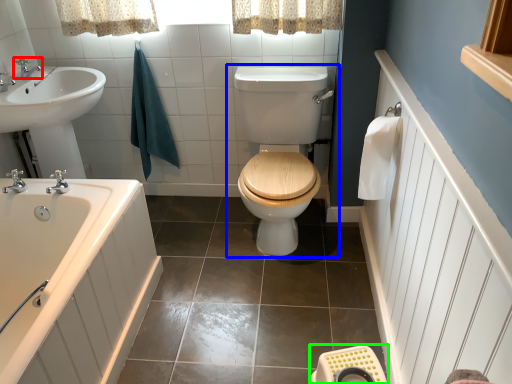
Question: Based on their relative distances, which object is nearer to tap (highlighted by a red box)? Choose from toilet (highlighted by a blue box) and porcelain (highlighted by a green box).

Choices:
 (A) toilet
 (B) porcelain

Answer: (A)